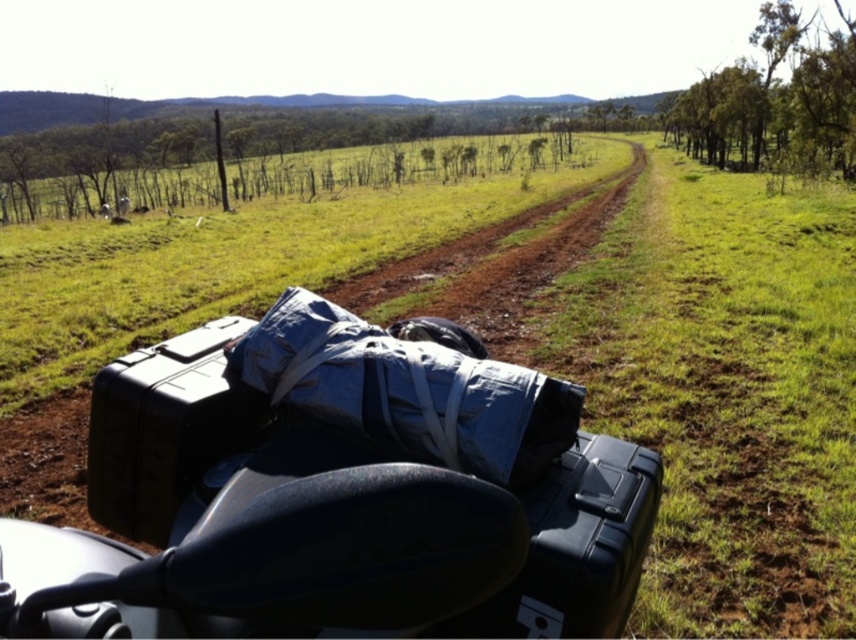
Is point (177, 426) positioned behind point (658, 474)?

Yes.

Can you confirm if black hard case at lower left is positioned to the right of black hard case at lower right?

No, black hard case at lower left is not to the right of black hard case at lower right.

Between point (152, 490) and point (581, 452), which one is positioned in front?

Positioned in front is point (581, 452).

This screenshot has width=856, height=640. I want to click on black hard case at lower left, so click(x=164, y=428).

Can you confirm if brown dirt track at center is wider than black hard case at lower right?

Yes.

Where is `brown dirt track at center`? This screenshot has width=856, height=640. brown dirt track at center is located at coordinates (488, 244).

The height and width of the screenshot is (640, 856). Describe the element at coordinates (488, 244) in the screenshot. I see `brown dirt track at center` at that location.

Does point (87, 508) come closer to viewer compared to point (119, 532)?

No, (87, 508) is further to viewer.

Where is `brown dirt track at center`? brown dirt track at center is located at coordinates click(x=488, y=244).